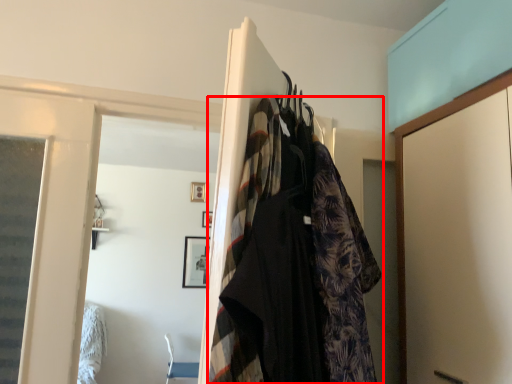
Question: From the image's perspective, where is fancy dress (annotated by the red box) located relative to clothing?

Choices:
 (A) below
 (B) above

Answer: (B)